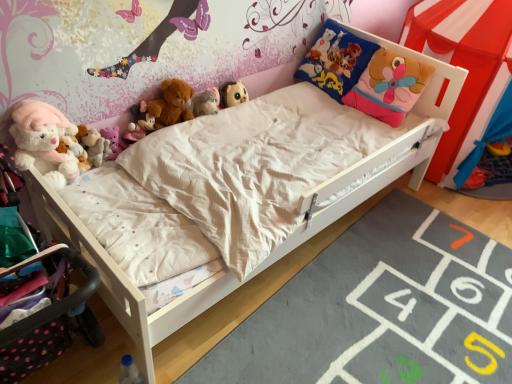
Question: Is blue plastic bottle at lower left, the 8th toy from the top, bigger or smaller than fluffy plush toy at upper center, the second toy when ordered from top to bottom?

Choices:
 (A) small
 (B) big

Answer: (A)

Question: From the image's perspective, is blue plastic bottle at lower left, the 8th toy from the top, above or below fluffy plush toy at upper center, the second toy when ordered from top to bottom?

Choices:
 (A) below
 (B) above

Answer: (A)

Question: Estimate the real-world distances between objects in this image. Which object is closer to the fluffy white teddy bear at center, positioned as the 8th toy in bottom-to-top order?

Choices:
 (A) soft plush pillow at upper right
 (B) fluffy plush toys at left, which ranks as the 6th toy in top-to-bottom order
 (C) red fabric canopy bed at upper right
 (D) gray soft rug at lower right
 (E) fluffy white plush at upper left, positioned as the 2th toy in bottom-to-top order

Answer: (B)

Question: Considering the real-world distances, which object is farthest from the fluffy white plush at upper left, positioned as the 2th toy in bottom-to-top order?

Choices:
 (A) soft plush pillow at upper right
 (B) matte pink plush at upper left, which is counted as the fifth toy, starting from the bottom
 (C) fluffy plush toys at left, which ranks as the 6th toy in top-to-bottom order
 (D) pink plush toy at upper left, which ranks as the 5th toy in top-to-bottom order
 (E) gray soft rug at lower right

Answer: (A)